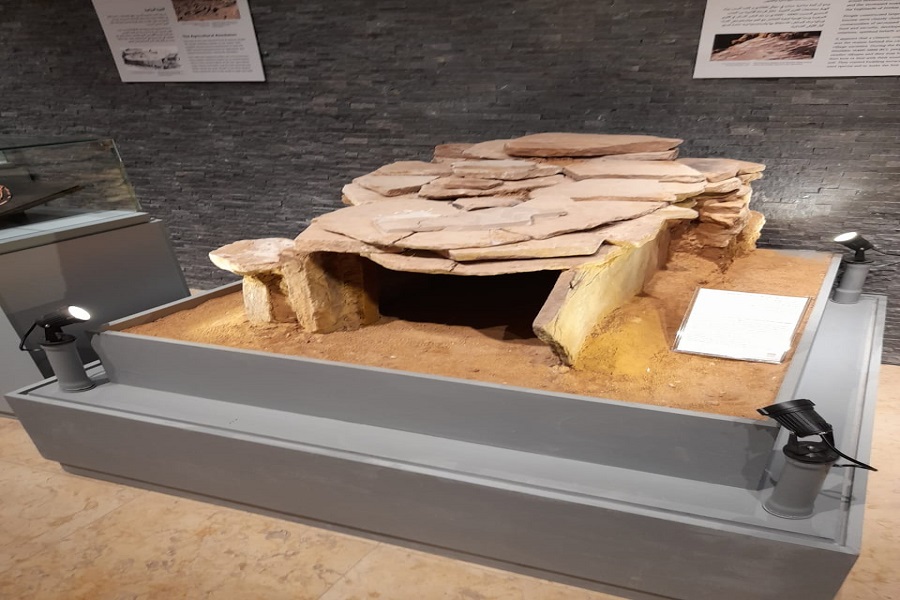
Where is `glass display case`? glass display case is located at coordinates (86, 164).